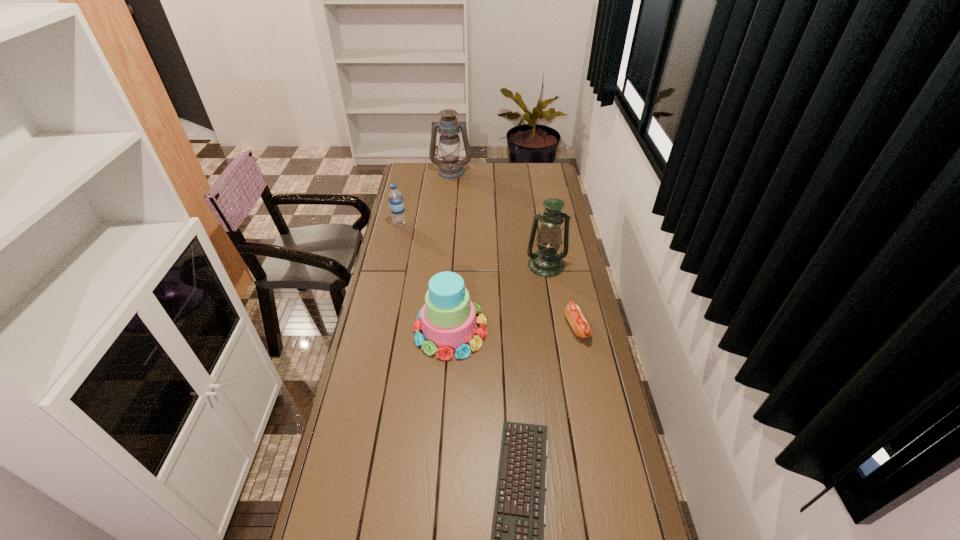
Identify the location of vacant space located 0.140m on the front of the cake. (446, 396).

This screenshot has height=540, width=960. Identify the location of blank space located 0.300m on the label of the water bottle. (468, 224).

Where is `free location located 0.110m on the front of the second shortest object`? Image resolution: width=960 pixels, height=540 pixels. free location located 0.110m on the front of the second shortest object is located at coordinates (586, 370).

You are a GUI agent. You are given a task and a screenshot of the screen. Output one action in this format:
    pyautogui.click(x=<x>, y=<y>)
    Task: Click on the object located at the far edge
    The height and width of the screenshot is (540, 960).
    Given the screenshot: What is the action you would take?
    pyautogui.click(x=450, y=167)

The height and width of the screenshot is (540, 960). I want to click on oil lamp at the left edge, so click(x=450, y=167).

This screenshot has height=540, width=960. Identify the location of water bottle that is at the left edge. (395, 196).

In order to click on oil lamp that is at the right edge in this screenshot , I will do `click(546, 262)`.

Locate an element on the screen. Image resolution: width=960 pixels, height=540 pixels. sausage positioned at the right edge is located at coordinates (581, 327).

This screenshot has width=960, height=540. In order to click on object at the far left corner in this screenshot , I will do `click(450, 167)`.

Where is `vacant region at the left edge of the desktop`? This screenshot has width=960, height=540. vacant region at the left edge of the desktop is located at coordinates (374, 360).